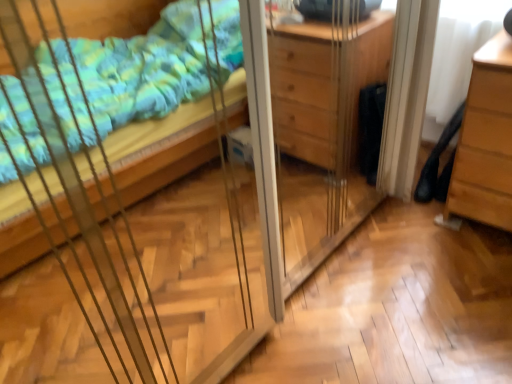
Find the location of a particular element. The image size is (512, 384). vacant area situated to the left side of light brown wood chest of drawers at right is located at coordinates (408, 228).